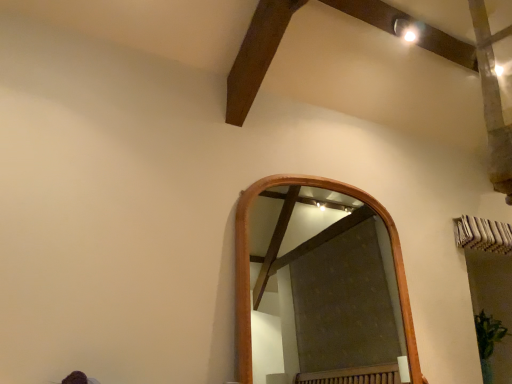
Where is `green leafy plant at lower right`? green leafy plant at lower right is located at coordinates (488, 341).

What do you see at coordinates (488, 341) in the screenshot?
I see `green leafy plant at lower right` at bounding box center [488, 341].

Locate an element on the screen. The height and width of the screenshot is (384, 512). green leafy plant at lower right is located at coordinates (488, 341).